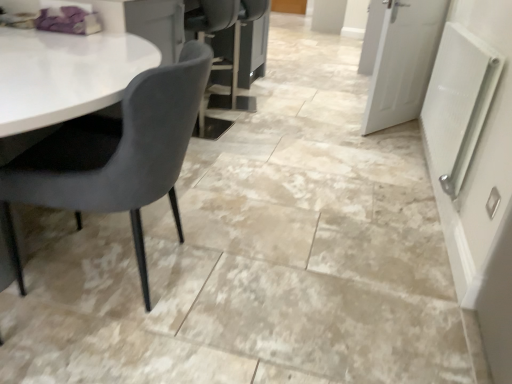
You are a GUI agent. You are given a task and a screenshot of the screen. Output one action in this format:
    pyautogui.click(x=<x>, y=<y>)
    Task: Click on the vacant space that's between white matte door at upper right, acting as the 2th door starting from the back, and velvet grey chair at left
    The width and height of the screenshot is (512, 384).
    Given the screenshot: What is the action you would take?
    click(286, 190)